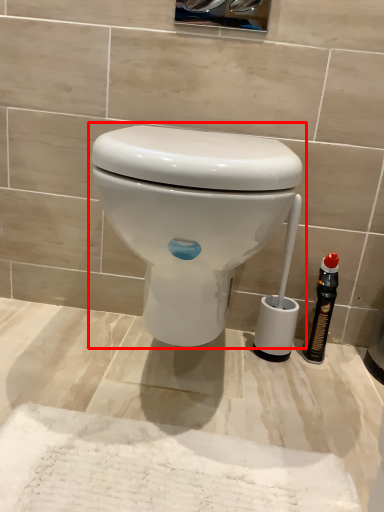
Question: From the image, what is the correct spatial relationship of toilet (annotated by the red box) in relation to bottle?

Choices:
 (A) right
 (B) left

Answer: (B)